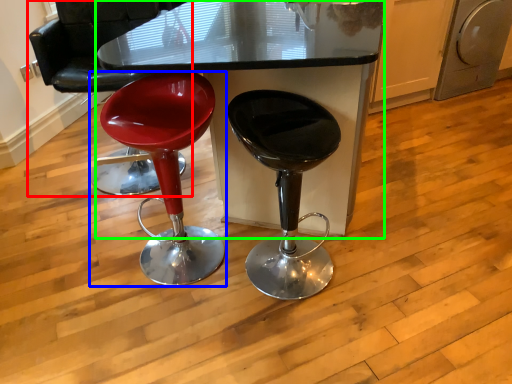
Question: Based on their relative distances, which object is farther from chair (highlighted by a red box)? Choose from stool (highlighted by a blue box) and table (highlighted by a green box).

Choices:
 (A) stool
 (B) table

Answer: (B)